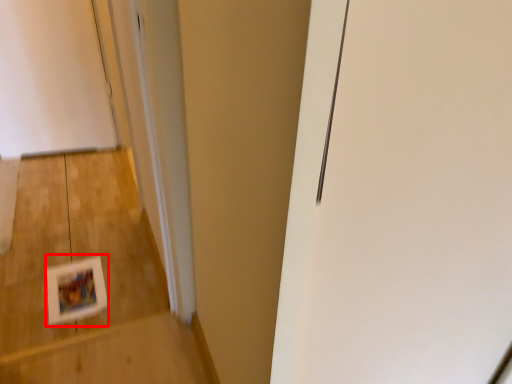
Question: From the image, what is the correct spatial relationship of postcard (annotated by the red box) in relation to stairwell?

Choices:
 (A) left
 (B) right

Answer: (B)